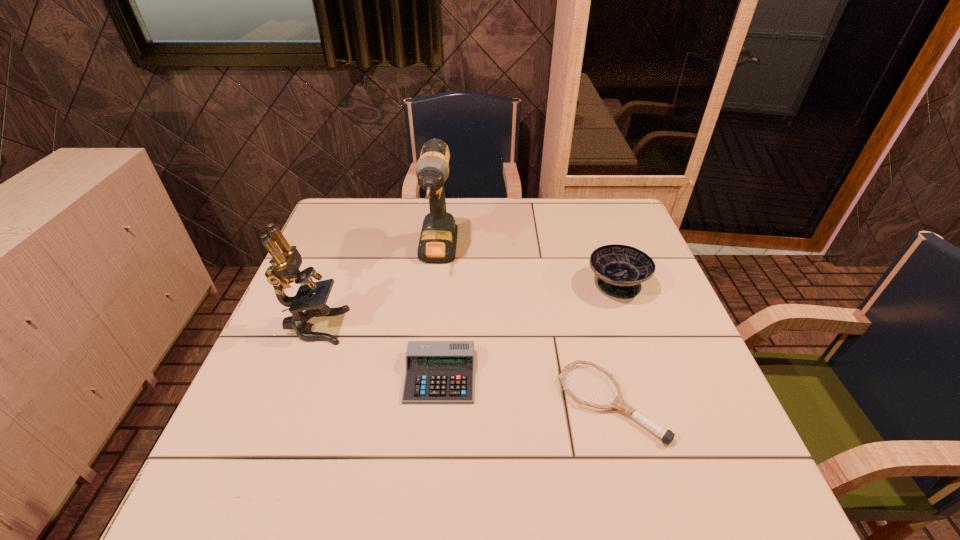
You are a GUI agent. You are given a task and a screenshot of the screen. Output one action in this format:
    pyautogui.click(x=<x>, y=<y>)
    Task: Click on the vacant area that lies between the shortest object and the third tallest object
    Image resolution: width=960 pixels, height=540 pixels.
    Given the screenshot: What is the action you would take?
    pyautogui.click(x=613, y=343)

Locate an element on the screen. free point between the third shortest object and the drill is located at coordinates (527, 269).

The width and height of the screenshot is (960, 540). Identify the location of free space between the microscope and the drill. (376, 291).

Locate an element on the screen. free space between the calculator and the drill is located at coordinates (439, 315).

Find the location of a particular element. The image size is (960, 540). vacant area that lies between the microscope and the drill is located at coordinates (376, 291).

This screenshot has height=540, width=960. I want to click on empty space that is in between the drill and the leftmost object, so click(376, 291).

In order to click on blank region between the drill and the third nearest object in this screenshot , I will do `click(376, 291)`.

Where is `object that is the third closest to the leftmost object`? Image resolution: width=960 pixels, height=540 pixels. object that is the third closest to the leftmost object is located at coordinates pos(667,436).

Locate which object is the second closest to the microscope. Please provide its 2D coordinates. Your answer should be formatted as a tuple, i.e. [(x, y)], where the tuple contains the x and y coordinates of a point satisfying the conditions above.

[(438, 239)]

This screenshot has width=960, height=540. In order to click on vacant area that satisfies the following two spatial constraints: 1. with the drill bit of the drill facing forward; 2. on the right side of the bowl in this screenshot , I will do `click(435, 284)`.